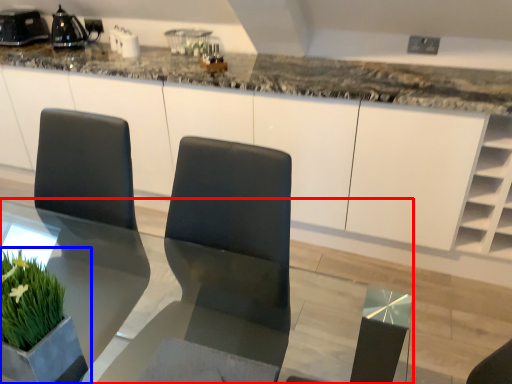
Question: Which point is further to the camera, table (highlighted by a red box) or houseplant (highlighted by a blue box)?

Choices:
 (A) table
 (B) houseplant

Answer: (B)